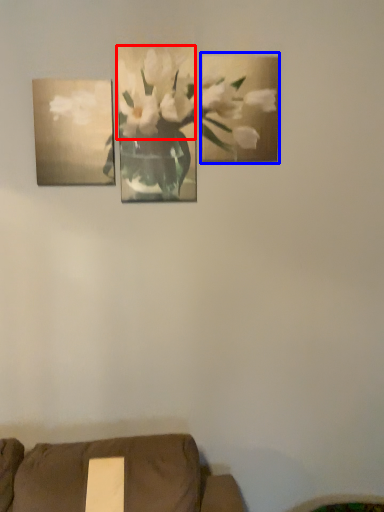
Question: Which object is closer to the camera taking this photo, flower (highlighted by a red box) or picture frame (highlighted by a blue box)?

Choices:
 (A) flower
 (B) picture frame

Answer: (A)